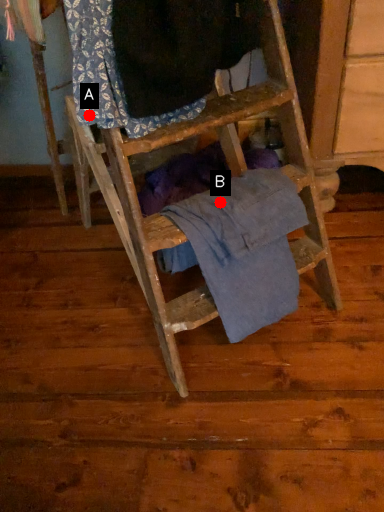
Question: Two points are circled on the image, labeled by A and B beside each circle. Which point is closer to the camera?

Choices:
 (A) A is closer
 (B) B is closer

Answer: (A)